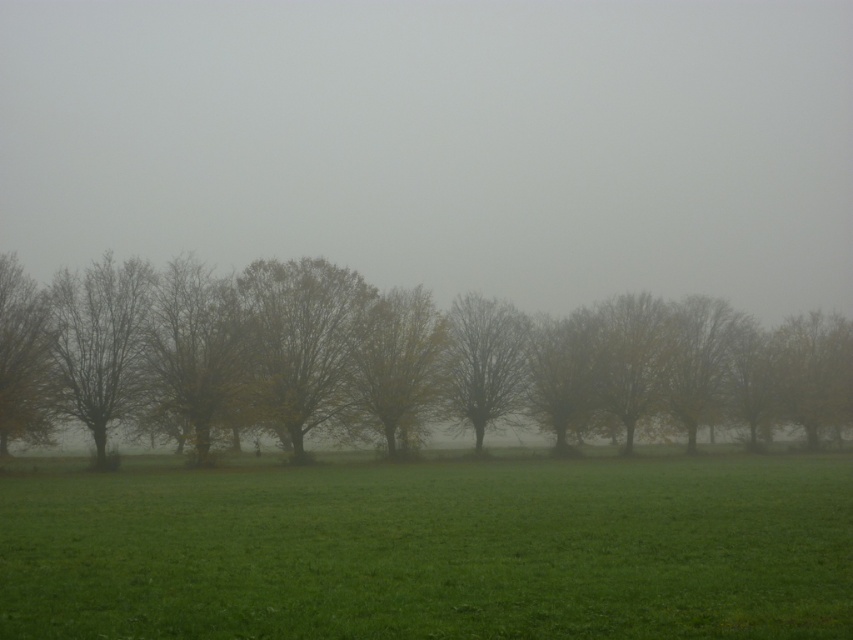
Question: Which object is the farthest from the brown leafy tree at center?

Choices:
 (A) yellow-green foliage at left
 (B) yellow-green foliage at center
 (C) bare branches at center
 (D) green grassy field at center

Answer: (D)

Question: Can you confirm if brown leafy tree at center is bigger than yellow-green foliage at left?

Choices:
 (A) no
 (B) yes

Answer: (B)

Question: Considering the relative positions of green grassy field at center and yellow-green foliage at center in the image provided, where is green grassy field at center located with respect to yellow-green foliage at center?

Choices:
 (A) above
 (B) below

Answer: (B)

Question: Which point appears farthest from the camera in this image?

Choices:
 (A) (45, 413)
 (B) (563, 563)
 (C) (447, 385)
 (D) (407, 401)

Answer: (C)

Question: Among these points, which one is farthest from the camera?

Choices:
 (A) coord(0,285)
 (B) coord(699,573)
 (C) coord(560,449)

Answer: (C)

Question: Is yellow-green foliage at center below bare branches at center?

Choices:
 (A) no
 (B) yes

Answer: (A)